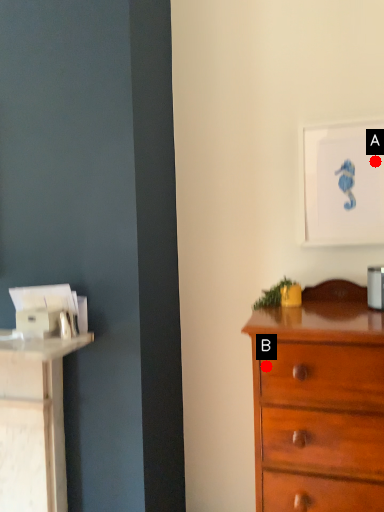
Question: Two points are circled on the image, labeled by A and B beside each circle. Which point is closer to the camera?

Choices:
 (A) A is closer
 (B) B is closer

Answer: (B)